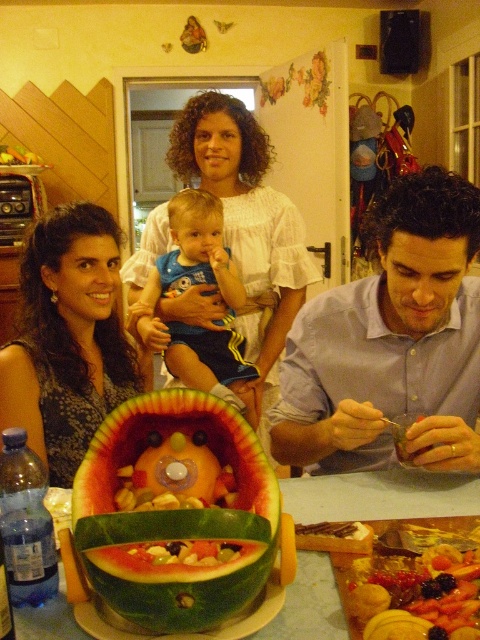
You are a guest at this event and want to sit between the white cotton dress at center and the blue denim shorts at center. Which one is closer to the doorway?

The blue denim shorts at center is closer to the doorway because the white cotton dress at center is bigger than blue denim shorts at center, implying the dress is further away from the doorway.

From the picture: You are standing in the kitchen and want to grab the blue denim shorts at center to take them to the laundry room. Can you reach them without moving closer?

The blue denim shorts at center is 1.58 meters away from viewer, so you can reach them without moving closer if your reaching distance is at least 1.58 meters.